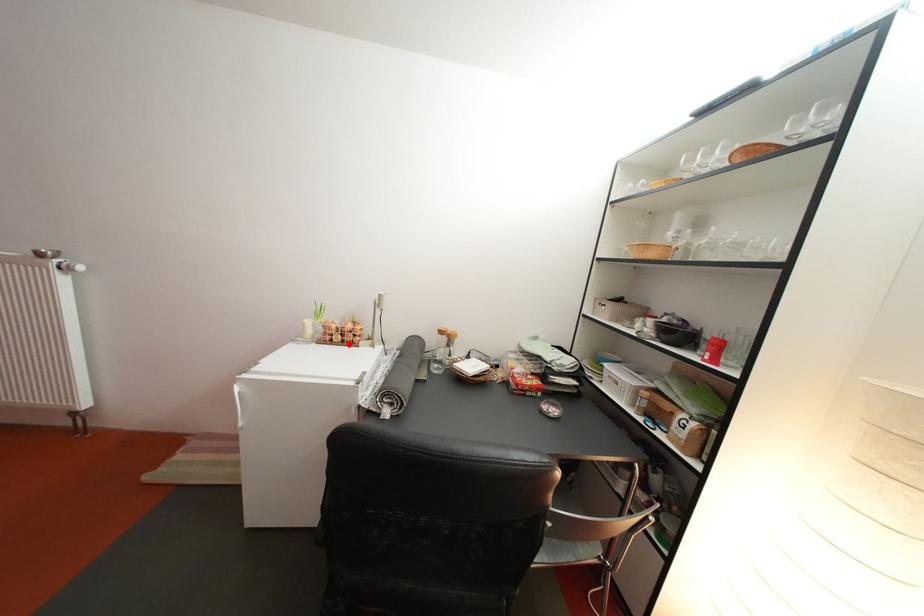
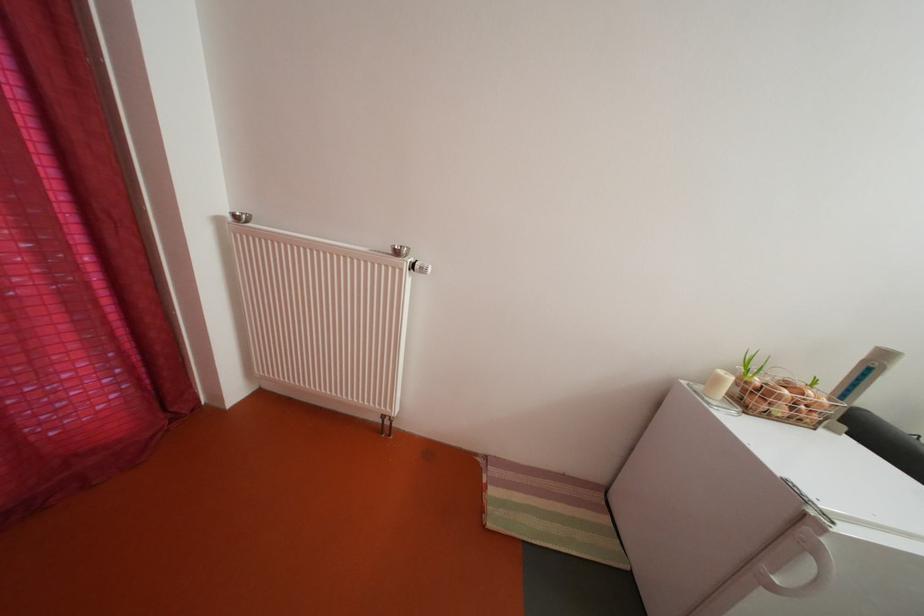
Find the pixel in the second image that matches the highlighted location in the first image.

(792, 416)